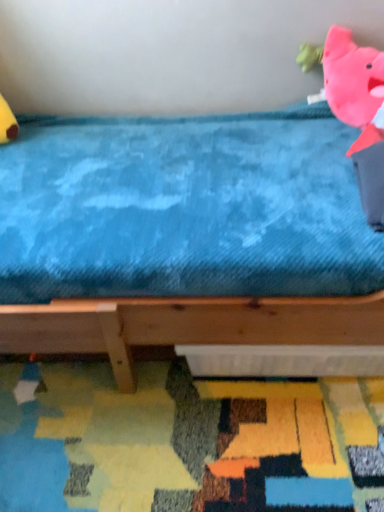
The width and height of the screenshot is (384, 512). In order to click on pink plush toy at upper right in this screenshot , I will do `click(350, 83)`.

The height and width of the screenshot is (512, 384). Describe the element at coordinates (350, 83) in the screenshot. I see `pink plush toy at upper right` at that location.

The height and width of the screenshot is (512, 384). What do you see at coordinates (186, 441) in the screenshot?
I see `textured multicolored mat at lower center` at bounding box center [186, 441].

Where is `pink plush toy at upper right`? This screenshot has height=512, width=384. pink plush toy at upper right is located at coordinates (350, 83).

Considering the sizes of objects pink plush toy at upper right and blue plush bed at upper center in the image provided, who is shorter, pink plush toy at upper right or blue plush bed at upper center?

With less height is pink plush toy at upper right.

Looking at their sizes, would you say pink plush toy at upper right is wider or thinner than blue plush bed at upper center?

Clearly, pink plush toy at upper right has less width compared to blue plush bed at upper center.

Which of these two, pink plush toy at upper right or blue plush bed at upper center, is bigger?

Bigger between the two is blue plush bed at upper center.

In the image, is pink plush toy at upper right on the left side or the right side of blue plush bed at upper center?

pink plush toy at upper right is positioned on blue plush bed at upper center's right side.

Looking at this image, between pink plush toy at upper right and textured multicolored mat at lower center, which one appears on the right side from the viewer's perspective?

Positioned to the right is pink plush toy at upper right.

From a real-world perspective, which is physically below, pink plush toy at upper right or textured multicolored mat at lower center?

textured multicolored mat at lower center is physically lower.

Can we say pink plush toy at upper right lies outside textured multicolored mat at lower center?

Yes, pink plush toy at upper right is not within textured multicolored mat at lower center.

Could you tell me if pink plush toy at upper right is facing textured multicolored mat at lower center?

No.

Between blue plush bed at upper center and textured multicolored mat at lower center, which one is positioned in front?

blue plush bed at upper center is closer to the camera.

From the picture: Does blue plush bed at upper center have a greater height compared to textured multicolored mat at lower center?

Yes.

Considering the relative sizes of blue plush bed at upper center and textured multicolored mat at lower center in the image provided, is blue plush bed at upper center wider than textured multicolored mat at lower center?

Indeed, blue plush bed at upper center has a greater width compared to textured multicolored mat at lower center.

Which of these two, blue plush bed at upper center or textured multicolored mat at lower center, is smaller?

With smaller size is textured multicolored mat at lower center.

Considering their positions, is textured multicolored mat at lower center located in front of or behind pink plush toy at upper right?

textured multicolored mat at lower center is in front of pink plush toy at upper right.

From a real-world perspective, is textured multicolored mat at lower center physically below pink plush toy at upper right?

Yes.

Which of these two, textured multicolored mat at lower center or pink plush toy at upper right, stands shorter?

Standing shorter between the two is textured multicolored mat at lower center.

Could you tell me if textured multicolored mat at lower center is facing pink plush toy at upper right?

No, textured multicolored mat at lower center does not turn towards pink plush toy at upper right.

Considering the sizes of blue plush bed at upper center and pink plush toy at upper right in the image, is blue plush bed at upper center bigger or smaller than pink plush toy at upper right?

In the image, blue plush bed at upper center appears to be larger than pink plush toy at upper right.

From a real-world perspective, is blue plush bed at upper center above or below pink plush toy at upper right?

blue plush bed at upper center is below pink plush toy at upper right.

Does blue plush bed at upper center have a lesser width compared to pink plush toy at upper right?

Incorrect, the width of blue plush bed at upper center is not less than that of pink plush toy at upper right.

Which object is further away from the camera taking this photo, blue plush bed at upper center or pink plush toy at upper right?

pink plush toy at upper right.

Is blue plush bed at upper center completely or partially inside textured multicolored mat at lower center?

No, blue plush bed at upper center is not surrounded by textured multicolored mat at lower center.

In terms of height, does textured multicolored mat at lower center look taller or shorter compared to blue plush bed at upper center?

Clearly, textured multicolored mat at lower center is shorter compared to blue plush bed at upper center.

Which object is closer to the camera taking this photo, textured multicolored mat at lower center or blue plush bed at upper center?

blue plush bed at upper center.

The width and height of the screenshot is (384, 512). I want to click on bed that is below the pink plush toy at upper right (from the image's perspective), so click(x=185, y=236).

You are a GUI agent. You are given a task and a screenshot of the screen. Output one action in this format:
    pyautogui.click(x=<x>, y=<y>)
    Task: Click on the mat located on the left of pink plush toy at upper right
    
    Given the screenshot: What is the action you would take?
    [x=186, y=441]

Which object lies nearer to the anchor point textured multicolored mat at lower center, pink plush toy at upper right or blue plush bed at upper center?

blue plush bed at upper center is positioned closer to the anchor textured multicolored mat at lower center.

From the image, which object appears to be farther from blue plush bed at upper center, pink plush toy at upper right or textured multicolored mat at lower center?

pink plush toy at upper right is positioned further to the anchor blue plush bed at upper center.

Considering their positions, is textured multicolored mat at lower center positioned closer to pink plush toy at upper right than blue plush bed at upper center?

blue plush bed at upper center.

Which object lies further to the anchor point textured multicolored mat at lower center, blue plush bed at upper center or pink plush toy at upper right?

pink plush toy at upper right is further to textured multicolored mat at lower center.

From the image, which object appears to be nearer to pink plush toy at upper right, blue plush bed at upper center or textured multicolored mat at lower center?

blue plush bed at upper center lies closer to pink plush toy at upper right than the other object.

Considering their positions, is textured multicolored mat at lower center positioned closer to blue plush bed at upper center than pink plush toy at upper right?

textured multicolored mat at lower center is positioned closer to the anchor blue plush bed at upper center.

Identify the location of bed between pink plush toy at upper right and textured multicolored mat at lower center in the up-down direction. The width and height of the screenshot is (384, 512). (185, 236).